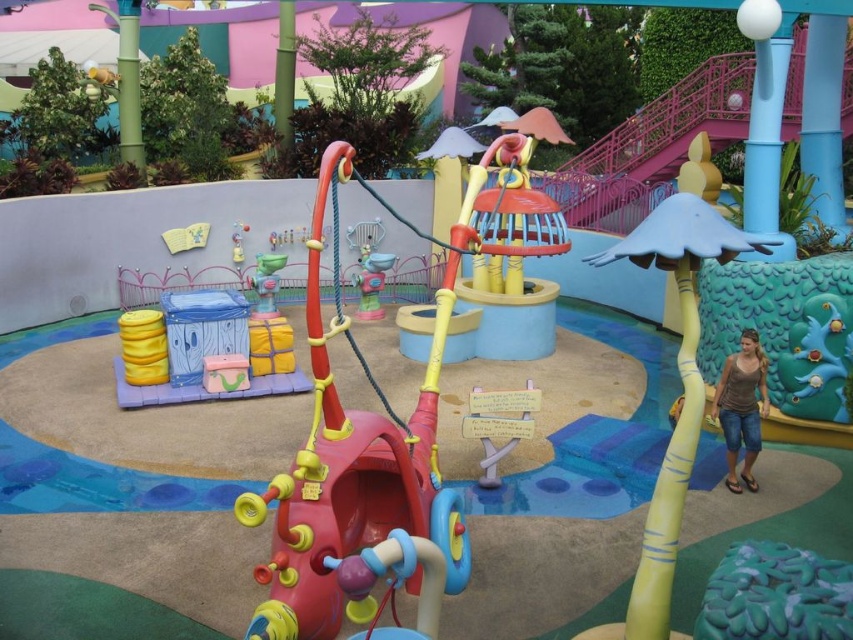
Question: Is yellow rubber mushroom at right bigger than denim shorts at lower right?

Choices:
 (A) no
 (B) yes

Answer: (B)

Question: Considering the relative positions of pastel wood toy at center and matte yellow toy at center in the image provided, where is pastel wood toy at center located with respect to matte yellow toy at center?

Choices:
 (A) below
 (B) above

Answer: (A)

Question: Is rubberized plastic swing at center closer to the viewer compared to matte yellow toy at center?

Choices:
 (A) yes
 (B) no

Answer: (A)

Question: Which point is closer to the camera?

Choices:
 (A) (643, 557)
 (B) (381, 262)
 (C) (762, 388)

Answer: (A)

Question: Which point appears farthest from the camera in this image?

Choices:
 (A) (381, 257)
 (B) (277, 552)

Answer: (A)

Question: Which point is closer to the camera?

Choices:
 (A) yellow rubber mushroom at right
 (B) rubberized plastic swing at center

Answer: (B)